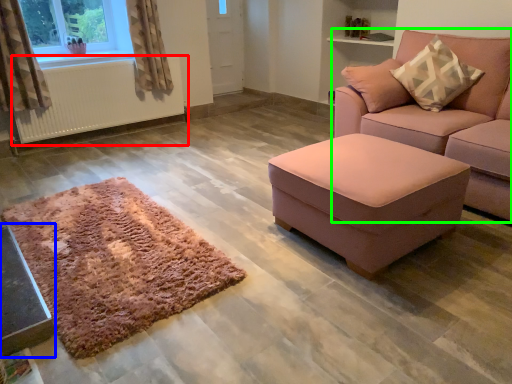
Question: Considering the real-world distances, which object is closest to radiator (highlighted by a red box)? table (highlighted by a blue box) or studio couch (highlighted by a green box).

Choices:
 (A) table
 (B) studio couch

Answer: (A)